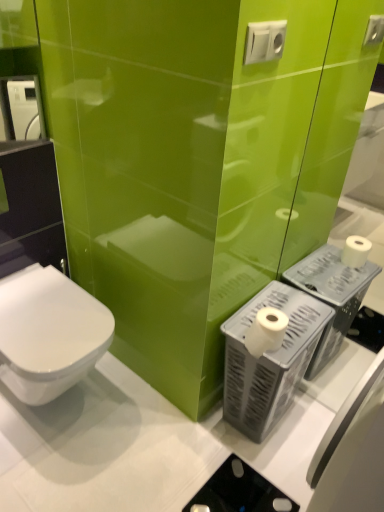
Find the location of a particular element. The width and height of the screenshot is (384, 512). vacant area that is in front of white plastic toilet paper holder at lower right is located at coordinates (255, 468).